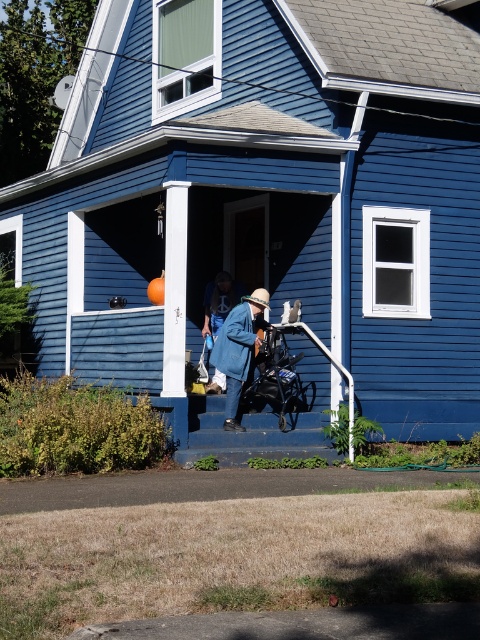
Who is lower down, blue denim jacket at center or blue fuzzy coat at center?

Positioned lower is blue denim jacket at center.

Which is in front, point (217, 353) or point (235, 301)?

Point (217, 353) is in front.

The image size is (480, 640). Identify the location of blue denim jacket at center. (239, 348).

Locate an element on the screen. This screenshot has width=480, height=640. blue denim jacket at center is located at coordinates (239, 348).

What do you see at coordinates (277, 381) in the screenshot? I see `black fabric baby carriage at center` at bounding box center [277, 381].

I want to click on black fabric baby carriage at center, so click(277, 381).

Where is `black fabric baby carriage at center`? The height and width of the screenshot is (640, 480). black fabric baby carriage at center is located at coordinates (277, 381).

Which is in front, point (300, 381) or point (230, 285)?

Point (300, 381) is more forward.

Is black fabric baby carriage at center to the left of blue fuzzy coat at center from the viewer's perspective?

Incorrect, black fabric baby carriage at center is not on the left side of blue fuzzy coat at center.

In order to click on black fabric baby carriage at center in this screenshot , I will do `click(277, 381)`.